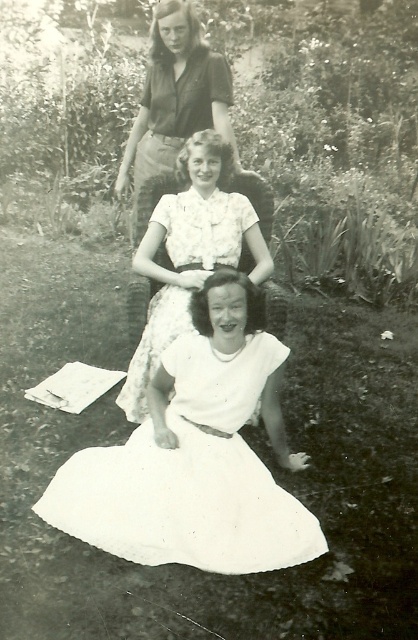
Question: Is white cotton dress at lower center positioned behind white satin dress at center?

Choices:
 (A) no
 (B) yes

Answer: (A)

Question: Which of the following is the closest to the observer?

Choices:
 (A) pos(211,461)
 (B) pos(129,369)

Answer: (A)

Question: Is white cotton dress at lower center positioned before white satin dress at center?

Choices:
 (A) no
 (B) yes

Answer: (B)

Question: Which object is closer to the camera taking this photo?

Choices:
 (A) white satin dress at center
 (B) white cotton dress at lower center

Answer: (B)

Question: Is white cotton dress at lower center above white satin dress at center?

Choices:
 (A) yes
 (B) no

Answer: (B)